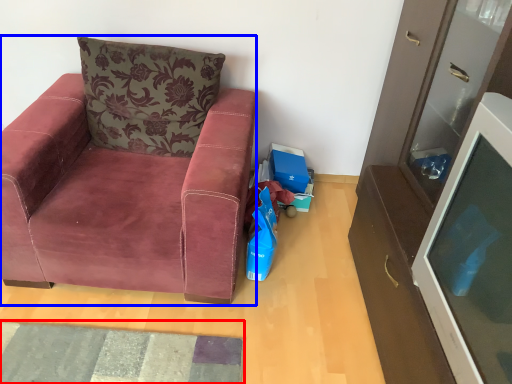
Question: Which point is closer to the camera, mat (highlighted by a red box) or chair (highlighted by a blue box)?

Choices:
 (A) mat
 (B) chair

Answer: (B)